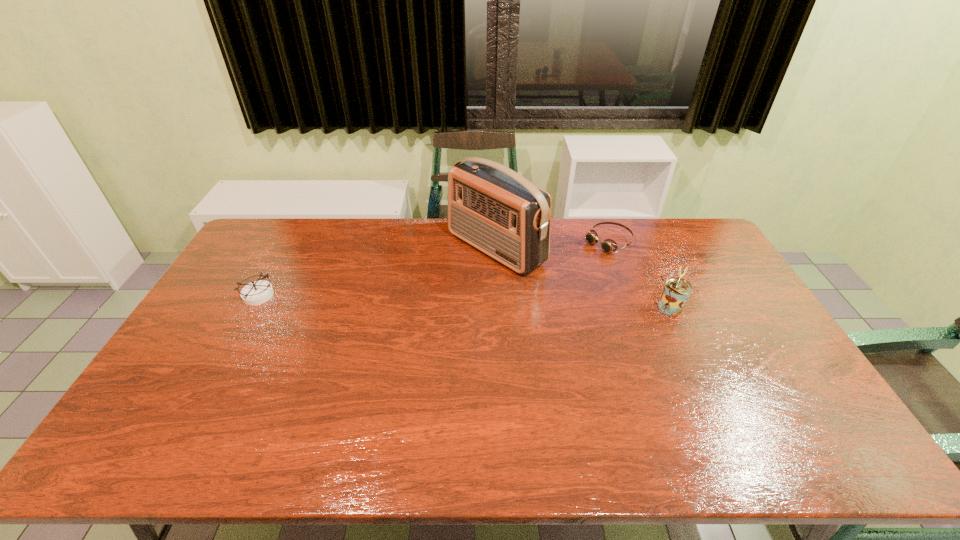
What are the coordinates of `free space on the desktop that is between the leftmost object and the third shortest object and is positioned through the lenses of the goggles` in the screenshot? It's located at (515, 303).

Where is `free space on the desktop that is between the leftmost object and the second tallest object and is positioned on the front-facing side of the tallest object`? This screenshot has width=960, height=540. free space on the desktop that is between the leftmost object and the second tallest object and is positioned on the front-facing side of the tallest object is located at coordinates (415, 300).